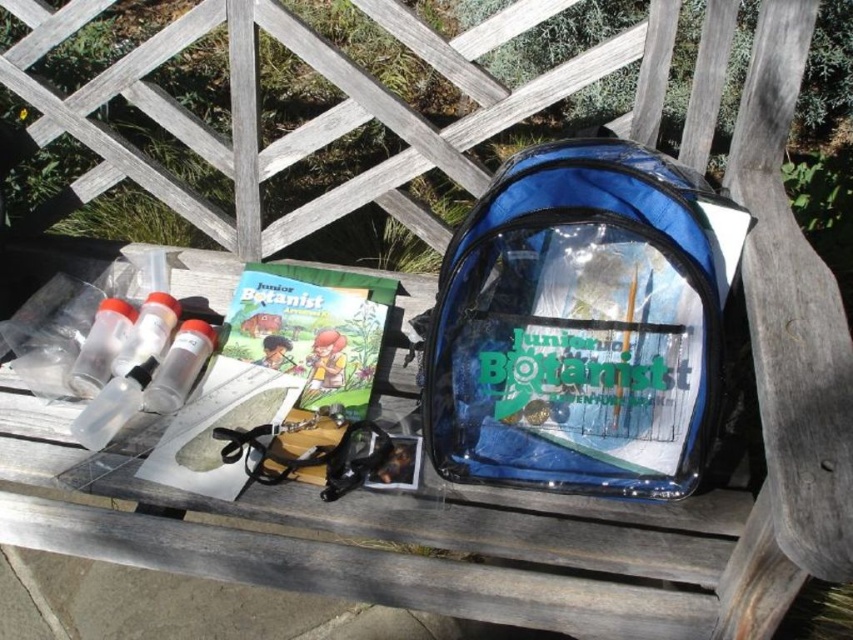
I want to click on transparent blue backpack at center, so click(x=581, y=324).

Is point (643, 225) positioned in front of point (323, 330)?

Yes, it is in front of point (323, 330).

What do you see at coordinates (581, 324) in the screenshot? This screenshot has width=853, height=640. I see `transparent blue backpack at center` at bounding box center [581, 324].

Locate an element on the screen. This screenshot has height=640, width=853. transparent blue backpack at center is located at coordinates (581, 324).